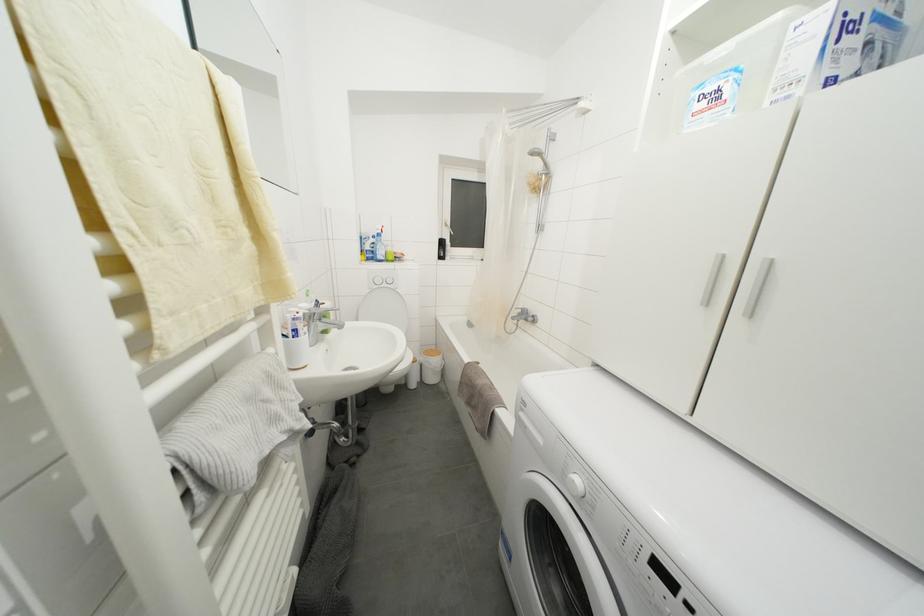
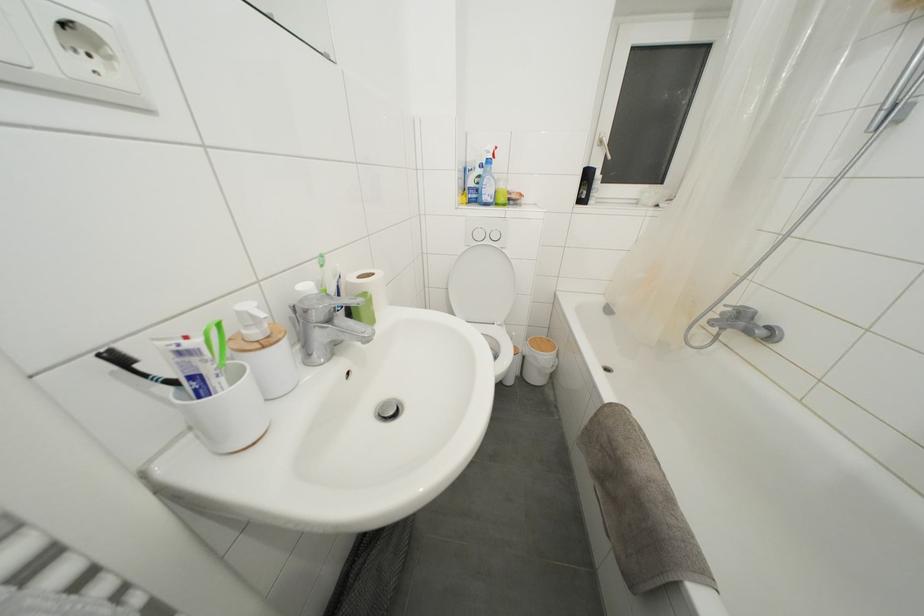
Question: Which direction would the cameraman need to move to produce the second image? Reply with the corresponding letter.

Choices:
 (A) Left
 (B) Right
 (C) Forward
 (D) Backward

Answer: (C)